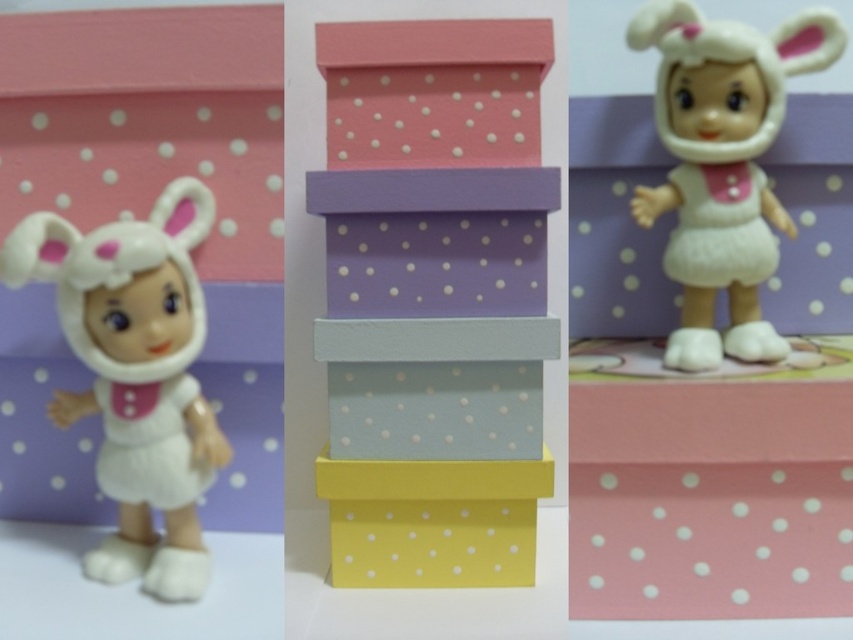
Which is above, white plush toy at left or matte pink box at center?

matte pink box at center

Which of these two, white plush toy at left or matte pink box at center, stands shorter?

matte pink box at center

Does point (136, 225) lie behind point (361, 68)?

No, (136, 225) is closer to viewer.

Identify the location of white plush toy at left. (136, 374).

Is pastel polka dot boxes at center above white plush toy at left?

Yes, pastel polka dot boxes at center is above white plush toy at left.

Is pastel polka dot boxes at center in front of white plush toy at left?

No, pastel polka dot boxes at center is behind white plush toy at left.

This screenshot has width=853, height=640. In order to click on pastel polka dot boxes at center in this screenshot , I will do `click(434, 300)`.

Which is more to the right, pastel polka dot boxes at center or white plush doll at upper right?

white plush doll at upper right

Is pastel polka dot boxes at center below white plush doll at upper right?

Yes, pastel polka dot boxes at center is below white plush doll at upper right.

What do you see at coordinates (434, 300) in the screenshot?
I see `pastel polka dot boxes at center` at bounding box center [434, 300].

At what (x,y) coordinates should I click in order to perform the action: click on pastel polka dot boxes at center. Please return your answer as a coordinate pair (x, y). This screenshot has width=853, height=640. Looking at the image, I should click on (434, 300).